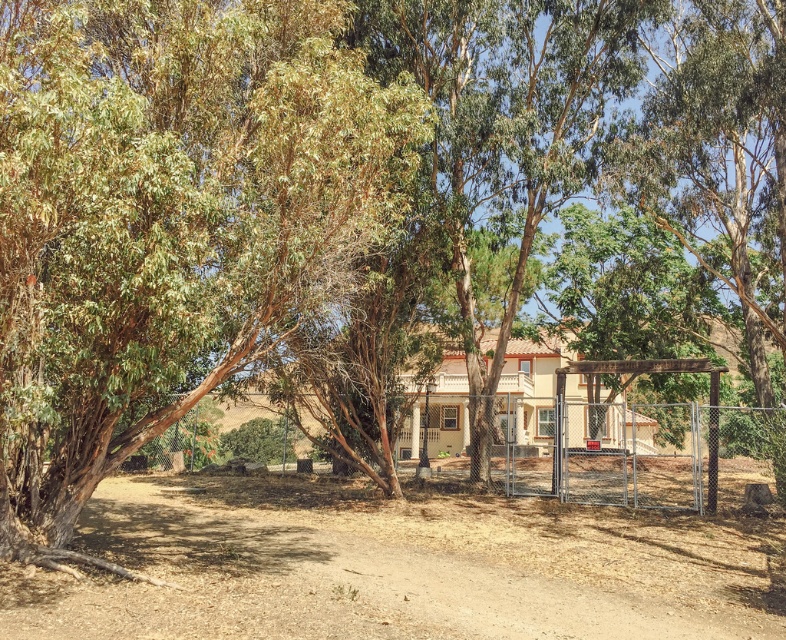
Question: Does green rough bark tree at left have a greater width compared to metallic chain-link fence at center-right?

Choices:
 (A) yes
 (B) no

Answer: (B)

Question: Can you confirm if brown sandy dirt field at center is smaller than metallic chain-link fence at center-right?

Choices:
 (A) no
 (B) yes

Answer: (B)

Question: Which point appears closest to the camera in this image?

Choices:
 (A) (659, 492)
 (B) (57, 234)

Answer: (B)

Question: Is green rough bark tree at left below brown sandy dirt field at center?

Choices:
 (A) yes
 (B) no

Answer: (B)

Question: Among these objects, which one is farthest from the camera?

Choices:
 (A) green rough bark tree at left
 (B) metallic chain-link fence at center-right

Answer: (B)

Question: Estimate the real-world distances between objects in this image. Which object is farther from the brown sandy dirt field at center?

Choices:
 (A) green rough bark tree at left
 (B) metallic chain-link fence at center-right

Answer: (B)